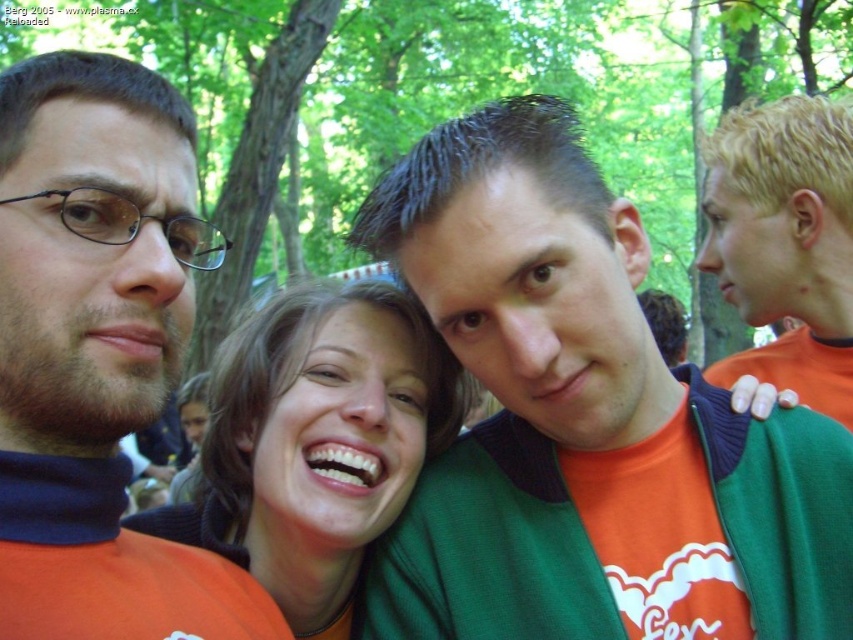
You are a photographer trying to capture a group photo of the orange fabric shirt at center and the matte orange shirt at center. Which one is on the right side when facing the group?

The orange fabric shirt at center is positioned on the right side of matte orange shirt at center, so when facing the group, the orange fabric shirt at center is on the right side.

You are taking a photo of the group in the forest. You want to focus on the person at point (538, 289) and the person at point (770, 221). Which person will be in sharper focus if you focus on the closer one?

The person at point (538, 289) will be in sharper focus because it is closer to the camera than the person at point (770, 221).

You are taking a photo of two points in a forest scene. The first point is at coordinates point [349,611] and the second is at point [810,365]. Which point is closer to the camera?

Point [349,611] is closer to the camera than point [810,365].